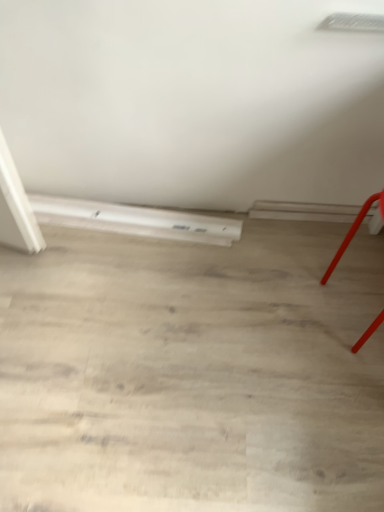
The image size is (384, 512). Describe the element at coordinates (135, 220) in the screenshot. I see `white matte heater at lower left` at that location.

Find the location of a particular element. white matte heater at lower left is located at coordinates (135, 220).

The height and width of the screenshot is (512, 384). Describe the element at coordinates (354, 231) in the screenshot. I see `smooth red chair at right` at that location.

Locate an element on the screen. This screenshot has width=384, height=512. smooth red chair at right is located at coordinates 354,231.

At what (x,y) coordinates should I click in order to perform the action: click on white matte heater at lower left. Please return your answer as a coordinate pair (x, y). This screenshot has height=512, width=384. Looking at the image, I should click on (135, 220).

Visually, is white matte heater at lower left positioned to the left or to the right of smooth red chair at right?

white matte heater at lower left is positioned on smooth red chair at right's left side.

Who is more distant, white matte heater at lower left or smooth red chair at right?

white matte heater at lower left.

Does point (122, 221) lie in front of point (357, 224)?

No, it is not.

From the image's perspective, is white matte heater at lower left under smooth red chair at right?

No.

From a real-world perspective, between white matte heater at lower left and smooth red chair at right, who is vertically lower?

In real-world perspective, white matte heater at lower left is lower.

In the scene shown: Does white matte heater at lower left have a greater width compared to smooth red chair at right?

Incorrect, the width of white matte heater at lower left does not surpass that of smooth red chair at right.

Considering the sizes of white matte heater at lower left and smooth red chair at right in the image, is white matte heater at lower left taller or shorter than smooth red chair at right?

In the image, white matte heater at lower left appears to be shorter than smooth red chair at right.

Who is bigger, white matte heater at lower left or smooth red chair at right?

smooth red chair at right.

Is white matte heater at lower left not inside smooth red chair at right?

white matte heater at lower left lies outside smooth red chair at right's area.

Is white matte heater at lower left far away from smooth red chair at right?

white matte heater at lower left is near smooth red chair at right, not far away.

Is white matte heater at lower left aimed at smooth red chair at right?

No, white matte heater at lower left is not turned towards smooth red chair at right.

What's the angular difference between white matte heater at lower left and smooth red chair at right's facing directions?

96.5 degrees separate the facing orientations of white matte heater at lower left and smooth red chair at right.

In order to click on furniture below the white matte heater at lower left (from the image's perspective) in this screenshot , I will do `click(354, 231)`.

Considering the relative positions of smooth red chair at right and white matte heater at lower left in the image provided, is smooth red chair at right to the left of white matte heater at lower left from the viewer's perspective?

In fact, smooth red chair at right is to the right of white matte heater at lower left.

Between smooth red chair at right and white matte heater at lower left, which one is positioned in front?

smooth red chair at right is in front.

Is point (381, 215) closer to viewer compared to point (223, 245)?

Yes.

From the image's perspective, between smooth red chair at right and white matte heater at lower left, which one is located above?

white matte heater at lower left.

From a real-world perspective, which is physically above, smooth red chair at right or white matte heater at lower left?

In real-world perspective, smooth red chair at right is above.

Considering the sizes of smooth red chair at right and white matte heater at lower left in the image, is smooth red chair at right wider or thinner than white matte heater at lower left?

Clearly, smooth red chair at right has more width compared to white matte heater at lower left.

Is smooth red chair at right taller than white matte heater at lower left?

Indeed, smooth red chair at right has a greater height compared to white matte heater at lower left.

Considering the sizes of smooth red chair at right and white matte heater at lower left in the image, is smooth red chair at right bigger or smaller than white matte heater at lower left?

In the image, smooth red chair at right appears to be larger than white matte heater at lower left.

Is white matte heater at lower left a part of smooth red chair at right?

No, white matte heater at lower left is not a part of smooth red chair at right.

Is smooth red chair at right not near white matte heater at lower left?

That's not correct — smooth red chair at right is a little close to white matte heater at lower left.

Is smooth red chair at right aimed at white matte heater at lower left?

No, smooth red chair at right is not aimed at white matte heater at lower left.

What's the angular difference between smooth red chair at right and white matte heater at lower left's facing directions?

smooth red chair at right and white matte heater at lower left are facing 96.5 degrees away from each other.

How much distance is there between smooth red chair at right and white matte heater at lower left?

smooth red chair at right is 24.94 inches from white matte heater at lower left.

This screenshot has width=384, height=512. There is a white matte heater at lower left. What are the coordinates of `furniture above it (from a real-world perspective)` in the screenshot? It's located at (354, 231).

Where is `plank below the smooth red chair at right (from a real-world perspective)`? The height and width of the screenshot is (512, 384). plank below the smooth red chair at right (from a real-world perspective) is located at coordinates (135, 220).

The width and height of the screenshot is (384, 512). Identify the location of plank lying on the left of smooth red chair at right. (135, 220).